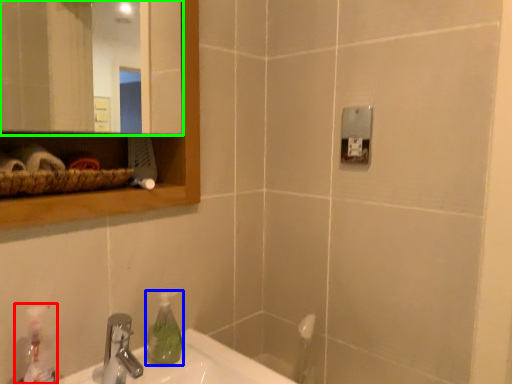
Question: Estimate the real-world distances between objects in this image. Which object is closer to cleaning product (highlighted by a red box), soap dispenser (highlighted by a blue box) or mirror (highlighted by a green box)?

Choices:
 (A) soap dispenser
 (B) mirror

Answer: (A)